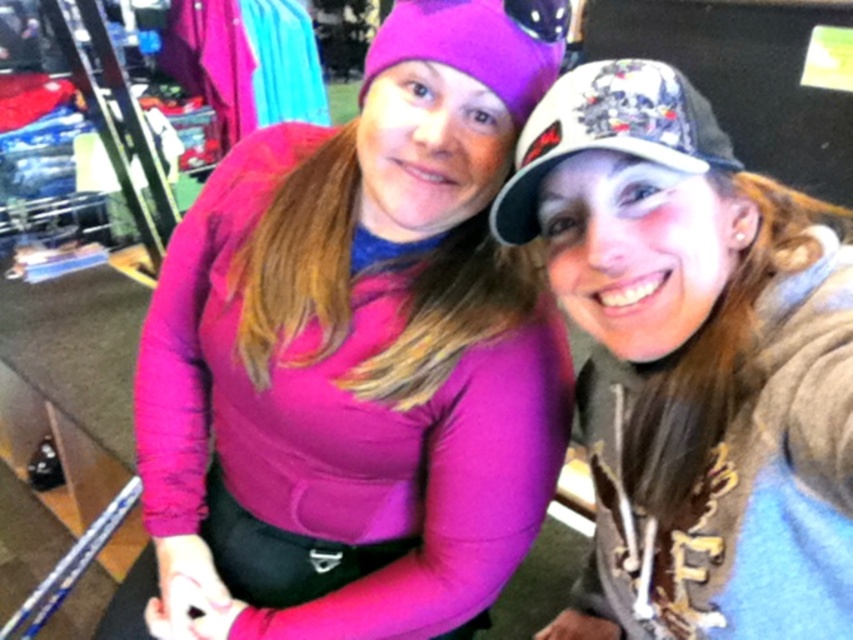
You are taking a photo of two friends. You notice the matte pink sweater at center and the white textured cap at upper right. Which object is closer to the camera?

The matte pink sweater at center is closer to the camera because the white textured cap at upper right is behind it.

You are a photographer trying to frame a shot of the matte pink sweater at center and the white textured cap at upper right. If you want to ensure both objects are fully visible in the frame, which object should you prioritize centering your camera on?

The matte pink sweater at center might be wider than the white textured cap at upper right, so prioritizing the sweater in the center would ensure both are visible as the sweater is likely larger and central to the composition.